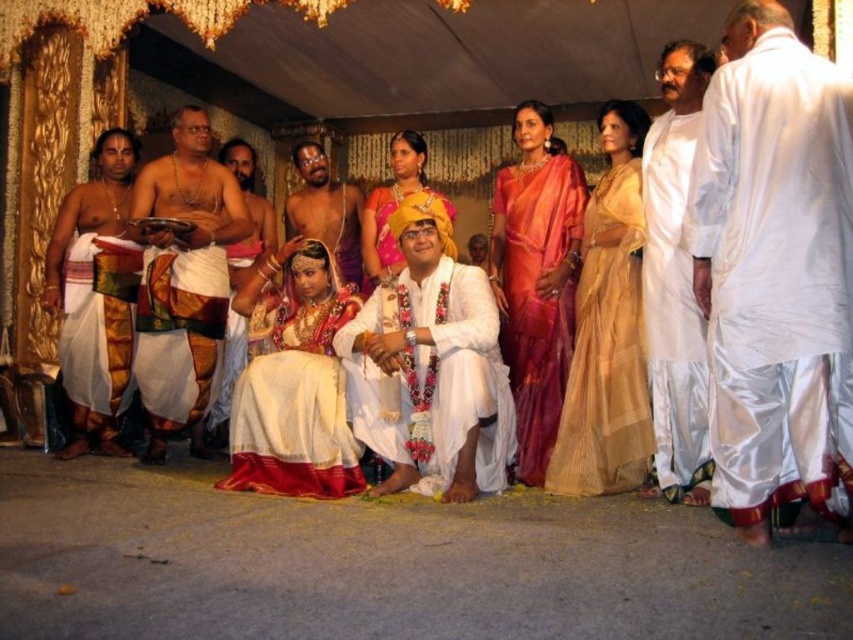
Question: From the image, what is the correct spatial relationship of white silk saree at center in relation to white silk kurta at right?

Choices:
 (A) above
 (B) below

Answer: (B)

Question: Is white satin dhoti at right further to camera compared to silky orange sari at center?

Choices:
 (A) no
 (B) yes

Answer: (A)

Question: Among these objects, which one is nearest to the camera?

Choices:
 (A) golden silk saree at center
 (B) white silk kurta at right

Answer: (B)

Question: Which point is closer to the camera?

Choices:
 (A) silky orange sari at center
 (B) white satin dhoti at right
 (C) matte gold turban at center

Answer: (B)

Question: Is golden silk saree at center in front of white silk dhoti at left?

Choices:
 (A) no
 (B) yes

Answer: (B)

Question: Considering the real-world distances, which object is closest to the matte white saree at left?

Choices:
 (A) white satin saree at center
 (B) matte white dhoti at left
 (C) matte gold turban at center
 (D) white silk saree at center

Answer: (B)